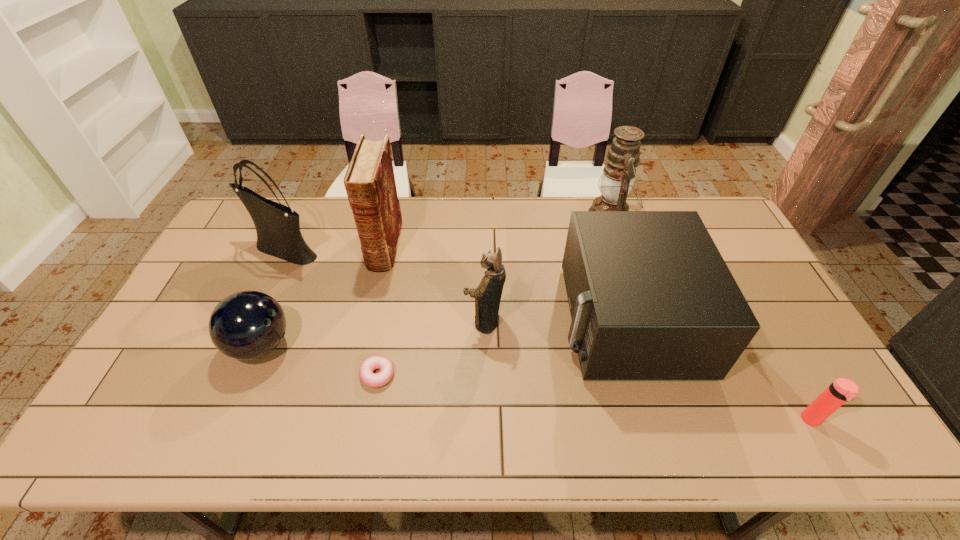
Where is `free space located on the back of the rightmost object`? The width and height of the screenshot is (960, 540). free space located on the back of the rightmost object is located at coordinates [764, 334].

At what (x,y) coordinates should I click in order to perform the action: click on free point located on the right of the shortest object. Please return your answer as a coordinate pair (x, y). Looking at the image, I should click on (441, 375).

Identify the location of lantern at the far edge. (622, 158).

Find the location of a particular element. This screenshot has width=960, height=540. hardback book located in the far edge section of the desktop is located at coordinates (369, 181).

The width and height of the screenshot is (960, 540). I want to click on shoulder bag at the far edge, so click(277, 226).

The width and height of the screenshot is (960, 540). I want to click on object at the near edge, so click(842, 390).

The height and width of the screenshot is (540, 960). I want to click on object located in the left edge section of the desktop, so click(277, 226).

Locate an element on the screen. Image resolution: width=960 pixels, height=540 pixels. object situated at the right edge is located at coordinates (842, 390).

Find the location of a particular element. Image resolution: width=960 pixels, height=540 pixels. object situated at the far left corner is located at coordinates (277, 226).

Identify the location of object that is at the near right corner. The width and height of the screenshot is (960, 540). (842, 390).